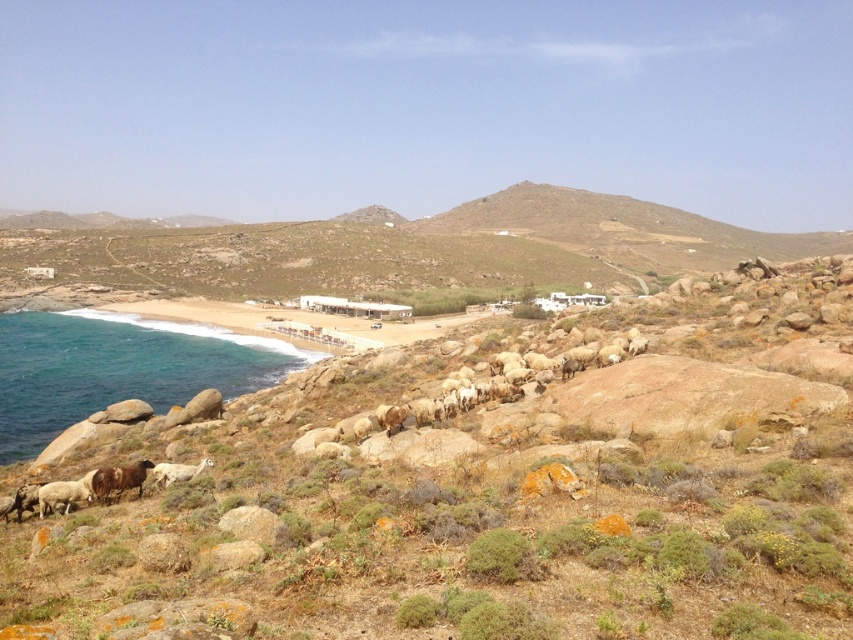
In the scene shown: Who is taller, brown rocky hillside at center or white woolly sheep at lower center?

brown rocky hillside at center is taller.

Who is shorter, brown rocky hillside at center or white woolly sheep at lower center?

Standing shorter between the two is white woolly sheep at lower center.

This screenshot has width=853, height=640. What do you see at coordinates (399, 248) in the screenshot?
I see `brown rocky hillside at center` at bounding box center [399, 248].

The width and height of the screenshot is (853, 640). In order to click on brown rocky hillside at center in this screenshot , I will do `click(399, 248)`.

Consider the image. Can you confirm if blue water at lower left is smaller than white woolly sheep at lower center?

No, blue water at lower left is not smaller than white woolly sheep at lower center.

Can you confirm if blue water at lower left is bigger than white woolly sheep at lower center?

Correct, blue water at lower left is larger in size than white woolly sheep at lower center.

Between point (164, 323) and point (170, 467), which one is positioned in front?

Point (170, 467)

Identify the location of blue water at lower left. The image size is (853, 640). (117, 369).

Does brown rocky hillside at center lie behind blue water at lower left?

Yes.

Can you confirm if brown rocky hillside at center is positioned to the right of blue water at lower left?

Yes, brown rocky hillside at center is to the right of blue water at lower left.

Is point (453, 259) positioned before point (151, 394)?

No, it is not.

Where is `brown rocky hillside at center`? brown rocky hillside at center is located at coordinates (399, 248).